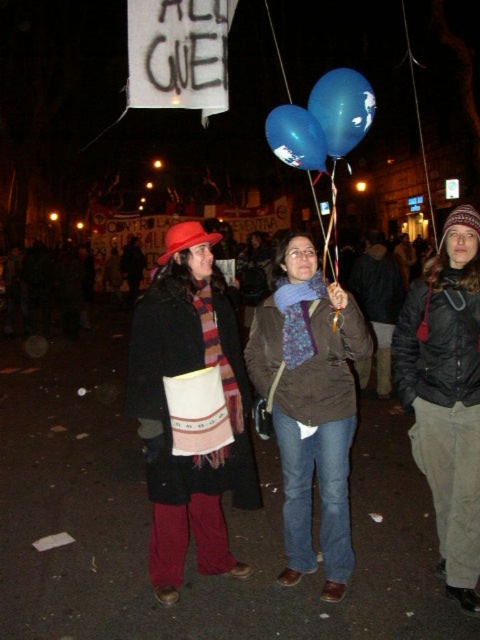
Is blue glossy balloon at center smaller than blue glossy balloons at center?

Correct, blue glossy balloon at center occupies less space than blue glossy balloons at center.

Does point (354, 86) come farther from viewer compared to point (288, 97)?

No, it is in front of (288, 97).

Between point (360, 124) and point (327, 220), which one is positioned behind?

The point (327, 220) is behind.

Where is `blue glossy balloon at center`? The width and height of the screenshot is (480, 640). blue glossy balloon at center is located at coordinates (342, 108).

Identify the location of matte brown jacket at center. The width and height of the screenshot is (480, 640). (311, 404).

Image resolution: width=480 pixels, height=640 pixels. What do you see at coordinates (311, 404) in the screenshot? I see `matte brown jacket at center` at bounding box center [311, 404].

What do you see at coordinates (311, 404) in the screenshot? This screenshot has width=480, height=640. I see `matte brown jacket at center` at bounding box center [311, 404].

This screenshot has height=640, width=480. I want to click on matte brown jacket at center, so click(x=311, y=404).

Who is taller, knitted wool scarf at center or matte brown jacket at center?

With more height is knitted wool scarf at center.

Which is more to the right, knitted wool scarf at center or matte brown jacket at center?

matte brown jacket at center

Between point (177, 355) and point (289, 416), which one is positioned in front?

Point (177, 355) is in front.

You are a GUI agent. You are given a task and a screenshot of the screen. Output one action in this format:
    pyautogui.click(x=<x>, y=<y>)
    Task: Click on the knitted wool scarf at center
    The height and width of the screenshot is (640, 480).
    Given the screenshot: What is the action you would take?
    pyautogui.click(x=169, y=417)